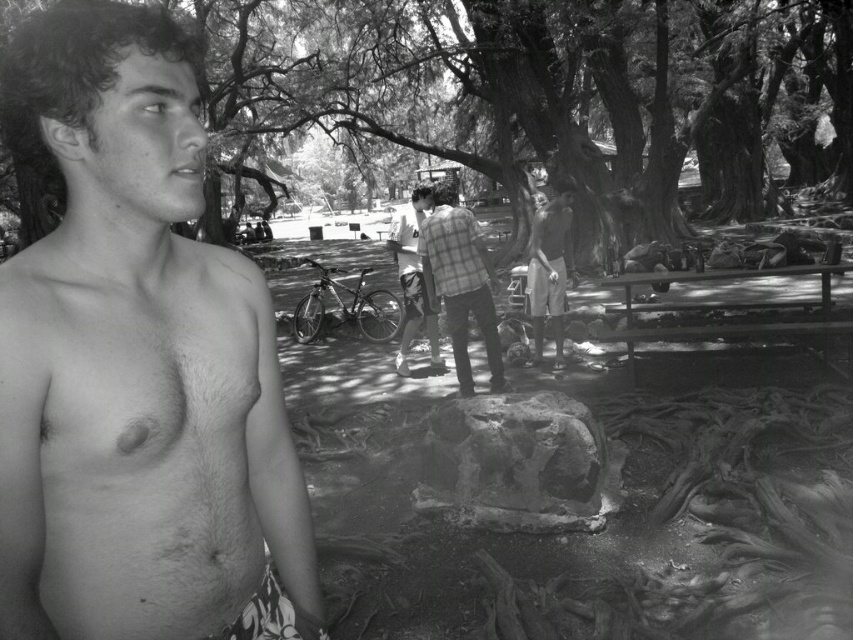
Question: Which of the following is the closest to the observer?

Choices:
 (A) coord(393,232)
 (B) coord(131,550)

Answer: (B)

Question: Which object is farther from the camera taking this photo?

Choices:
 (A) rough bark tree at center
 (B) plaid fabric shirt at center

Answer: (B)

Question: Is hairy skin at left bigger than checkered fabric shirt at center?

Choices:
 (A) no
 (B) yes

Answer: (A)

Question: Based on their relative distances, which object is nearer to the hairy skin at left?

Choices:
 (A) plaid shirt at center
 (B) checkered fabric shirt at center
 (C) plaid fabric shirt at center
 (D) rough bark tree at center

Answer: (C)

Question: Does rough bark tree at center have a larger size compared to checkered fabric shirt at center?

Choices:
 (A) yes
 (B) no

Answer: (A)

Question: Is hairy skin at left thinner than checkered fabric shirt at center?

Choices:
 (A) yes
 (B) no

Answer: (A)